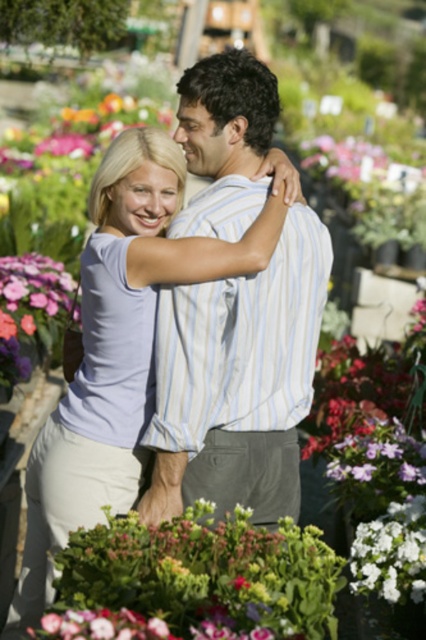
Find the location of `pink matte flower at lower left`. pink matte flower at lower left is located at coordinates (32, 308).

Which of these two, pink matte flower at lower left or white matte flower at center, stands taller?

With more height is pink matte flower at lower left.

Where is `pink matte flower at lower left`? pink matte flower at lower left is located at coordinates (32, 308).

The height and width of the screenshot is (640, 426). Identify the location of pink matte flower at lower left. (32, 308).

Does light purple cotton shirt at center appear on the right side of pink matte flower at lower left?

Indeed, light purple cotton shirt at center is positioned on the right side of pink matte flower at lower left.

Is light purple cotton shirt at center thinner than pink matte flower at lower left?

In fact, light purple cotton shirt at center might be wider than pink matte flower at lower left.

Is point (28, 524) farther from viewer compared to point (32, 294)?

No, (28, 524) is in front of (32, 294).

At what (x,y) coordinates should I click in order to perform the action: click on light purple cotton shirt at center. Please return your answer as a coordinate pair (x, y). The image size is (426, 640). Looking at the image, I should click on (123, 342).

Can you confirm if green leafy plant at center is positioned below pink matte flower at center?

No.

Which is in front, point (68, 628) or point (94, 627)?

Point (94, 627)

You are a GUI agent. You are given a task and a screenshot of the screen. Output one action in this format:
    pyautogui.click(x=<x>, y=<y>)
    Task: Click on the green leafy plant at center
    
    Given the screenshot: What is the action you would take?
    pyautogui.click(x=195, y=580)